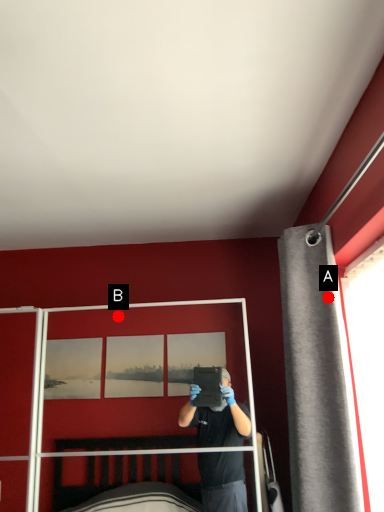
Question: Two points are circled on the image, labeled by A and B beside each circle. Which point is further to the camera?

Choices:
 (A) A is further
 (B) B is further

Answer: (B)